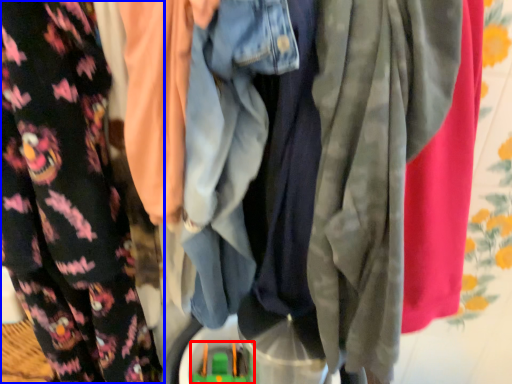
Question: Which of the following is the farthest to the observer, toy (highlighted by a red box) or fancy dress (highlighted by a blue box)?

Choices:
 (A) toy
 (B) fancy dress

Answer: (A)